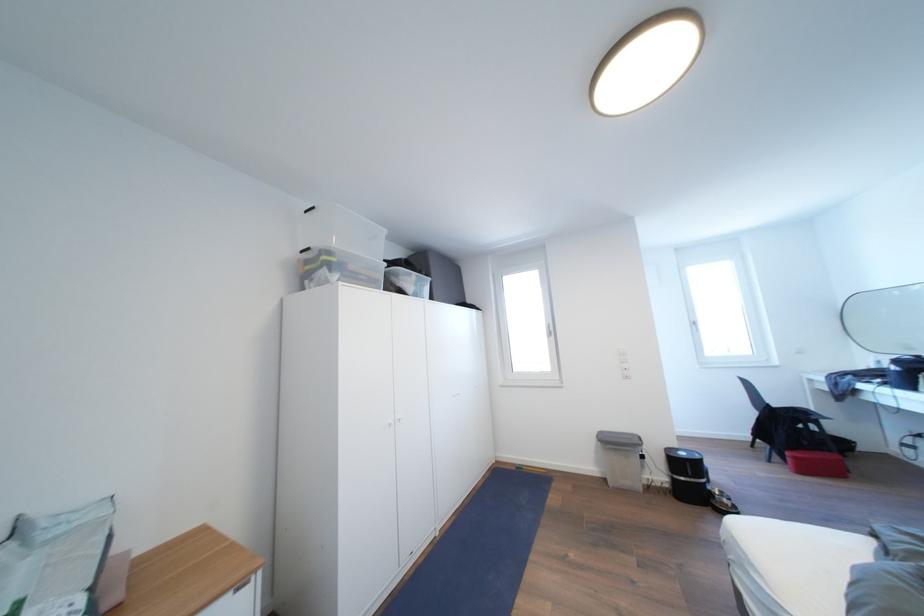
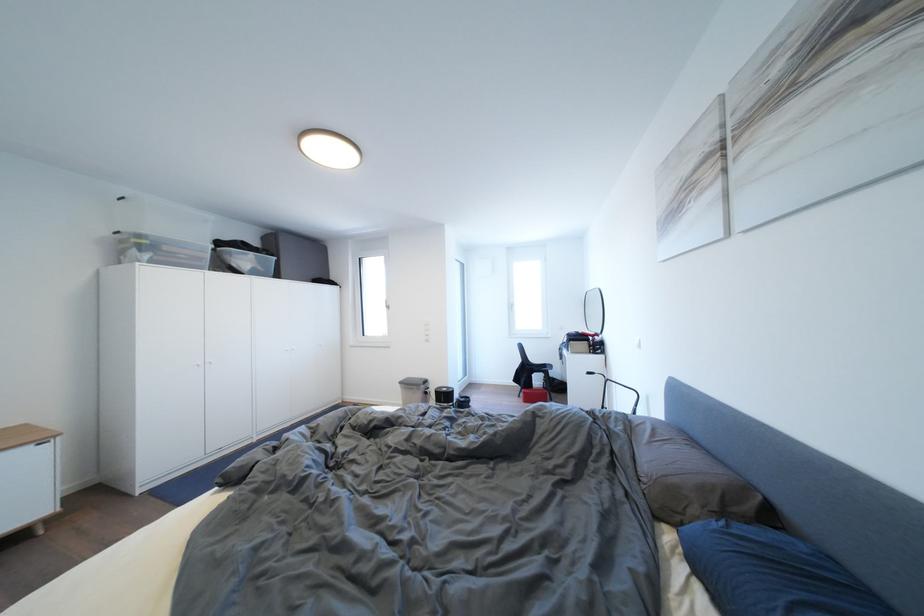
Where in the second image is the point corresponding to (803,463) from the first image?

(532, 398)